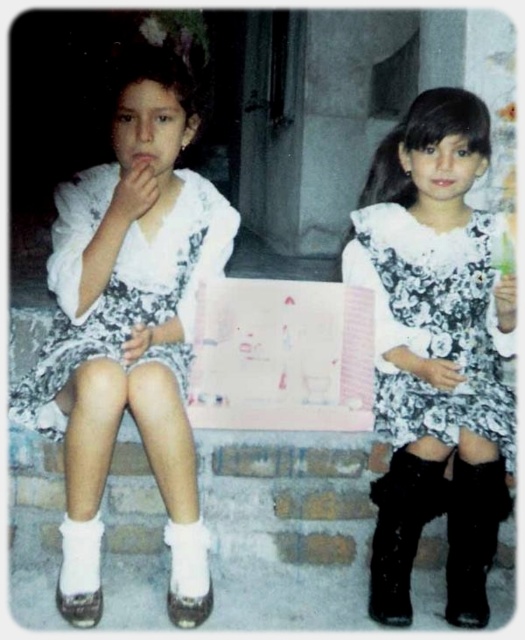
Looking at this image, is floral-patterned fabric dress at center below black leather boot at lower right?

No.

Measure the distance between floral-patterned fabric dress at center and camera.

floral-patterned fabric dress at center is 1.54 meters from camera.

You are a GUI agent. You are given a task and a screenshot of the screen. Output one action in this format:
    pyautogui.click(x=<x>, y=<y>)
    Task: Click on the floral-patterned fabric dress at center
    The width and height of the screenshot is (525, 640).
    Given the screenshot: What is the action you would take?
    pyautogui.click(x=434, y=324)

Can you confirm if white lace dress at left is shorter than black suede boot at lower right?

No, white lace dress at left is not shorter than black suede boot at lower right.

Is point (58, 308) farther from viewer compared to point (470, 563)?

Yes.

Is point (131, 314) closer to viewer compared to point (456, 512)?

No, it is behind (456, 512).

Locate an element on the screen. This screenshot has height=640, width=525. white lace dress at left is located at coordinates (123, 285).

Who is more distant from viewer, (185, 330) or (378, 580)?

Point (185, 330)

Between point (69, 250) and point (372, 600), which one is positioned behind?

Positioned behind is point (372, 600).

Find the location of a particular element. Image resolution: width=525 pixels, height=640 pixels. white lace dress at left is located at coordinates (123, 285).